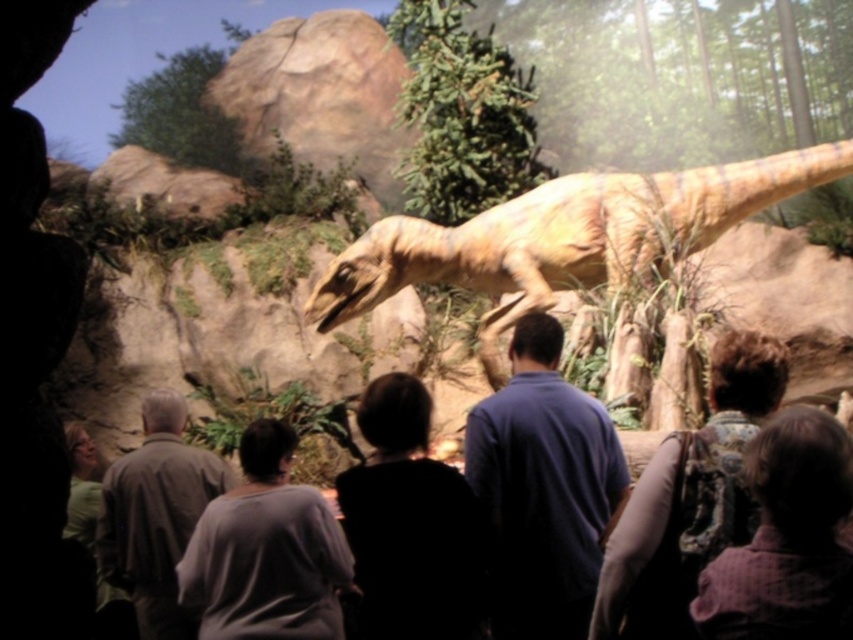
Who is higher up, black fabric at center or dark gray sweater at center?

black fabric at center is higher up.

Can you confirm if black fabric at center is positioned to the left of dark gray sweater at center?

Incorrect, black fabric at center is not on the left side of dark gray sweater at center.

Consider the image. Who is more distant from viewer, (392, 589) or (317, 540)?

Positioned behind is point (317, 540).

Identify the location of black fabric at center. (410, 524).

Between dark brown textured jacket at center and plaid fabric shirt at lower right, which one is positioned higher?

dark brown textured jacket at center is higher up.

Does dark brown textured jacket at center have a lesser height compared to plaid fabric shirt at lower right?

No, dark brown textured jacket at center is not shorter than plaid fabric shirt at lower right.

Which is in front, point (692, 531) or point (798, 596)?

Point (798, 596) is more forward.

Where is `dark brown textured jacket at center`? dark brown textured jacket at center is located at coordinates (692, 490).

Looking at this image, can you confirm if black fabric at center is taller than plaid fabric shirt at lower right?

Yes.

Consider the image. Who is positioned more to the right, black fabric at center or plaid fabric shirt at lower right?

plaid fabric shirt at lower right

Between point (463, 624) and point (804, 628), which one is positioned in front?

Point (804, 628)

I want to click on black fabric at center, so click(410, 524).